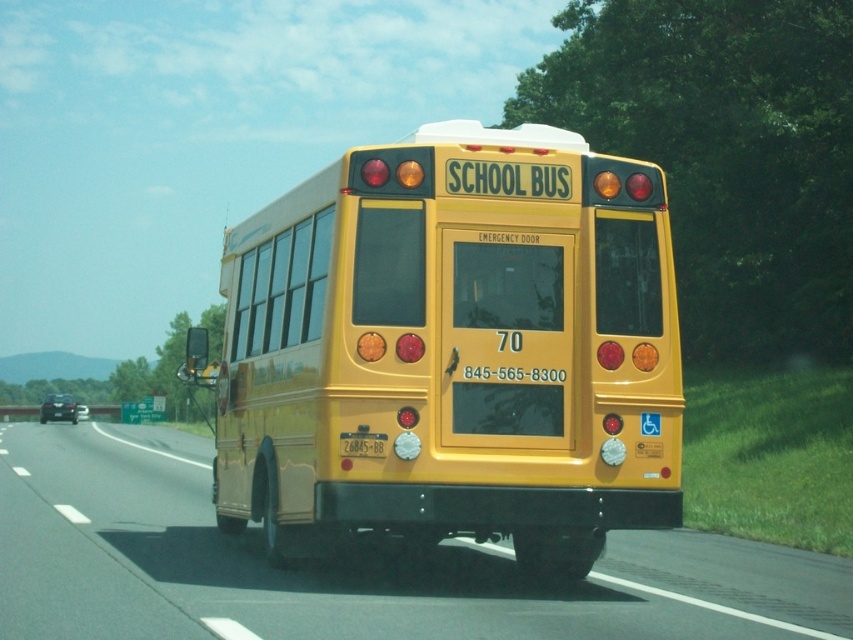
Question: Does yellow matte school bus at center have a smaller size compared to yellow matte license plate at center?

Choices:
 (A) no
 (B) yes

Answer: (A)

Question: Does yellow matte school bus at center appear on the right side of yellow matte license plate at center?

Choices:
 (A) no
 (B) yes

Answer: (A)

Question: Which point is farther to the camera?

Choices:
 (A) yellow matte/solid school bus at center
 (B) yellow matte school bus at center
 (C) yellow matte license plate at center

Answer: (C)

Question: Estimate the real-world distances between objects in this image. Which object is closer to the yellow matte/solid school bus at center?

Choices:
 (A) yellow matte license plate at center
 (B) yellow matte school bus at center

Answer: (A)

Question: Is yellow matte school bus at center wider than yellow matte license plate at center?

Choices:
 (A) no
 (B) yes

Answer: (B)

Question: Which object is closer to the camera taking this photo?

Choices:
 (A) yellow matte/solid school bus at center
 (B) yellow matte license plate at center

Answer: (A)